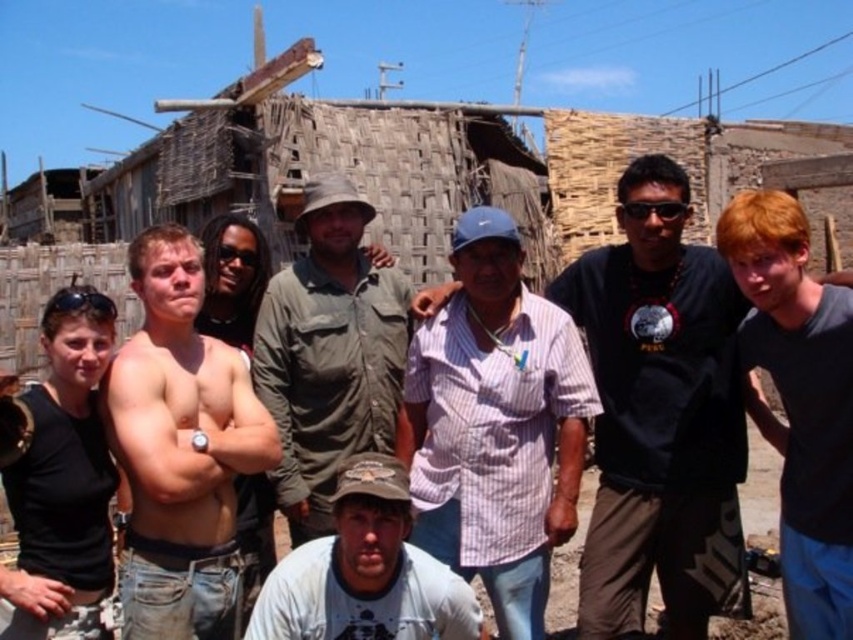
You are a photographer trying to capture a group photo of the striped cotton shirt at center and the pink striped shirt at center. Which one should you focus on first if you want to ensure both are in focus?

The striped cotton shirt at center is taller than the pink striped shirt at center, so focusing on the taller one first will help ensure both are in focus.